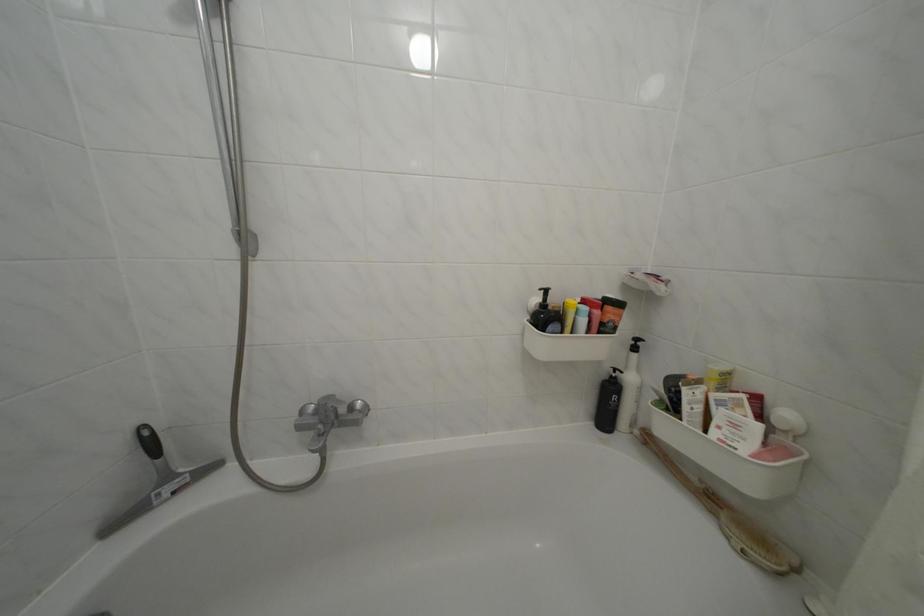
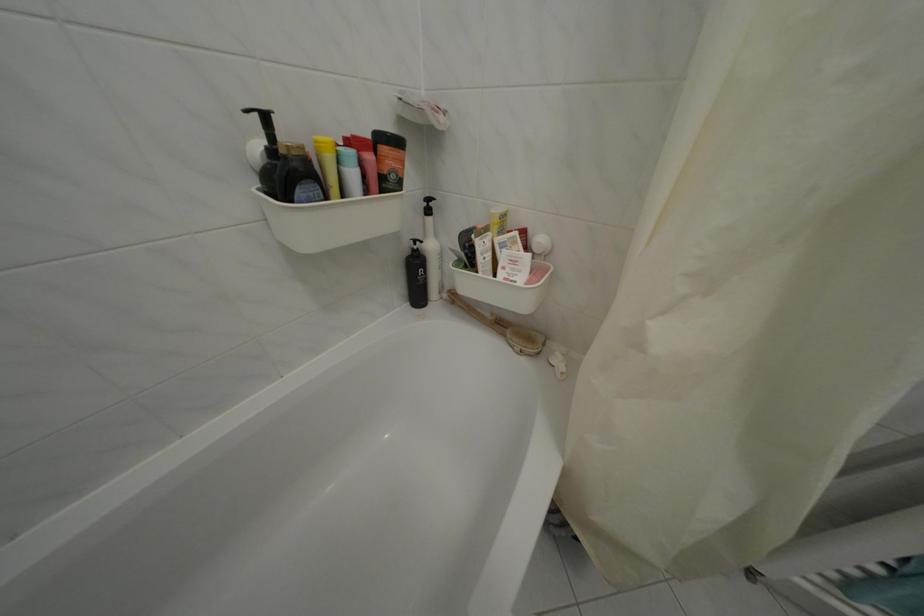
Find the pixel in the second image that matches pixel 646 438 in the first image.

(454, 302)